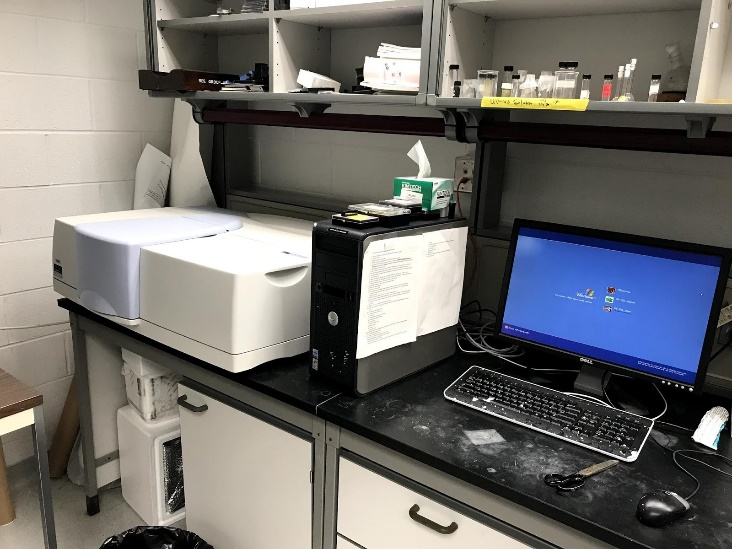
Where is `cord`? This screenshot has width=732, height=549. cord is located at coordinates (282, 448), (12, 333), (459, 201), (474, 339), (474, 306), (660, 408), (558, 369), (676, 461).